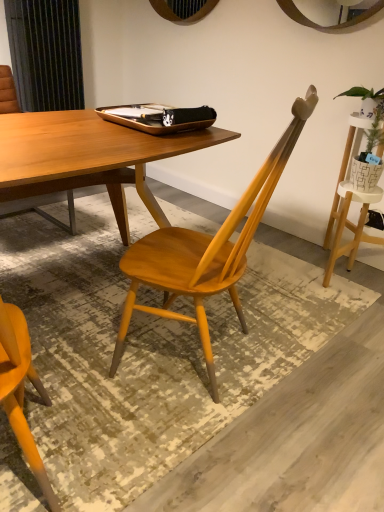
Question: Is matte wood chair at center to the right of wooden tray at center from the viewer's perspective?

Choices:
 (A) yes
 (B) no

Answer: (A)

Question: Is matte wood chair at center closer to camera compared to wooden tray at center?

Choices:
 (A) yes
 (B) no

Answer: (A)

Question: Does matte wood chair at center turn towards wooden tray at center?

Choices:
 (A) yes
 (B) no

Answer: (B)

Question: Is matte wood chair at center beside wooden tray at center?

Choices:
 (A) no
 (B) yes

Answer: (A)

Question: Is matte wood chair at center bigger than wooden tray at center?

Choices:
 (A) no
 (B) yes

Answer: (B)

Question: From a real-world perspective, is green leafy plant in woven basket at upper right physically located above or below wooden tray at center?

Choices:
 (A) below
 (B) above

Answer: (A)

Question: From the image's perspective, is green leafy plant in woven basket at upper right above or below wooden tray at center?

Choices:
 (A) below
 (B) above

Answer: (A)

Question: Is point (367, 146) closer or farther from the camera than point (130, 123)?

Choices:
 (A) closer
 (B) farther

Answer: (B)

Question: Looking at their shapes, would you say green leafy plant in woven basket at upper right is wider or thinner than wooden tray at center?

Choices:
 (A) thin
 (B) wide

Answer: (A)

Question: Considering the positions of point (170, 266) and point (162, 105), is point (170, 266) closer or farther from the camera than point (162, 105)?

Choices:
 (A) farther
 (B) closer

Answer: (B)

Question: Based on their positions, is matte wood chair at center located to the left or right of wooden tray at center?

Choices:
 (A) left
 (B) right

Answer: (B)

Question: From the image's perspective, is matte wood chair at center above or below wooden tray at center?

Choices:
 (A) above
 (B) below

Answer: (B)

Question: From a real-world perspective, is matte wood chair at center physically located above or below wooden tray at center?

Choices:
 (A) below
 (B) above

Answer: (A)

Question: Is matte wood chair at center inside or outside of green leafy plant in woven basket at upper right?

Choices:
 (A) inside
 (B) outside

Answer: (B)

Question: Considering the relative positions of matte wood chair at center and green leafy plant in woven basket at upper right in the image provided, is matte wood chair at center to the left or to the right of green leafy plant in woven basket at upper right?

Choices:
 (A) left
 (B) right

Answer: (A)